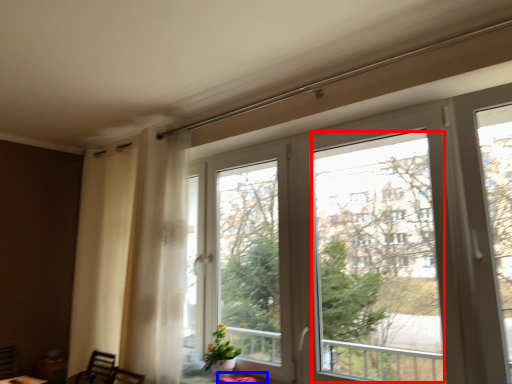
Question: Which point is further to the camera, window screen (highlighted by a red box) or table (highlighted by a blue box)?

Choices:
 (A) window screen
 (B) table

Answer: (B)